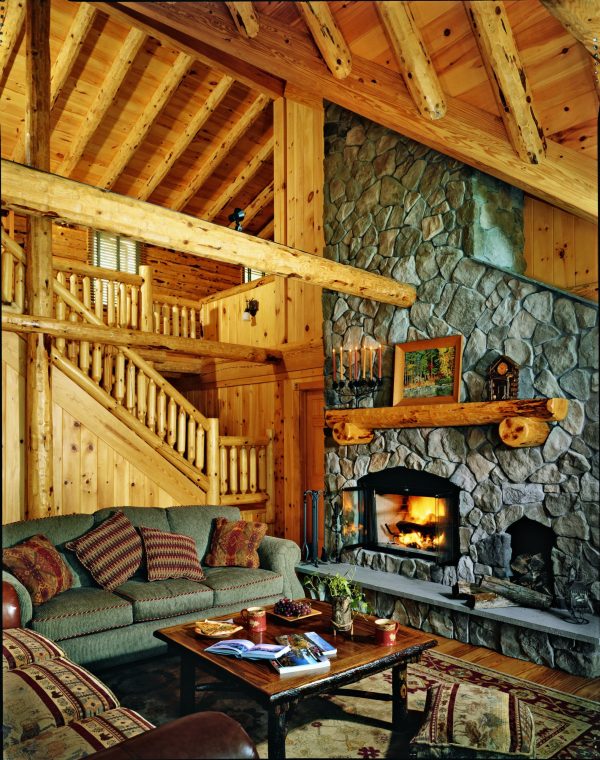
I want to click on gray ledge on fireplace, so click(387, 575), click(429, 591), click(531, 618).